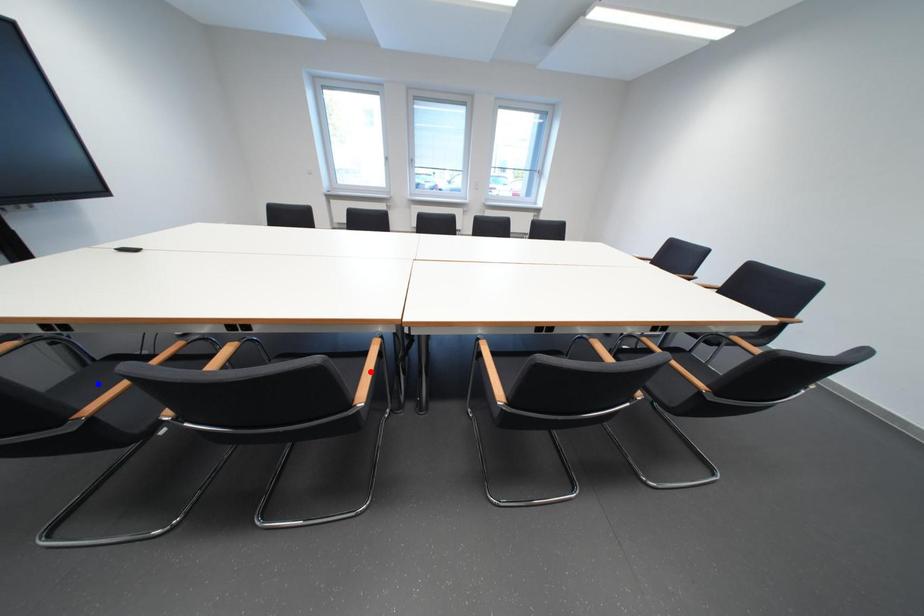
Question: Which of the two points in the image is closer to the camera?

Choices:
 (A) Blue point is closer.
 (B) Red point is closer.

Answer: (A)